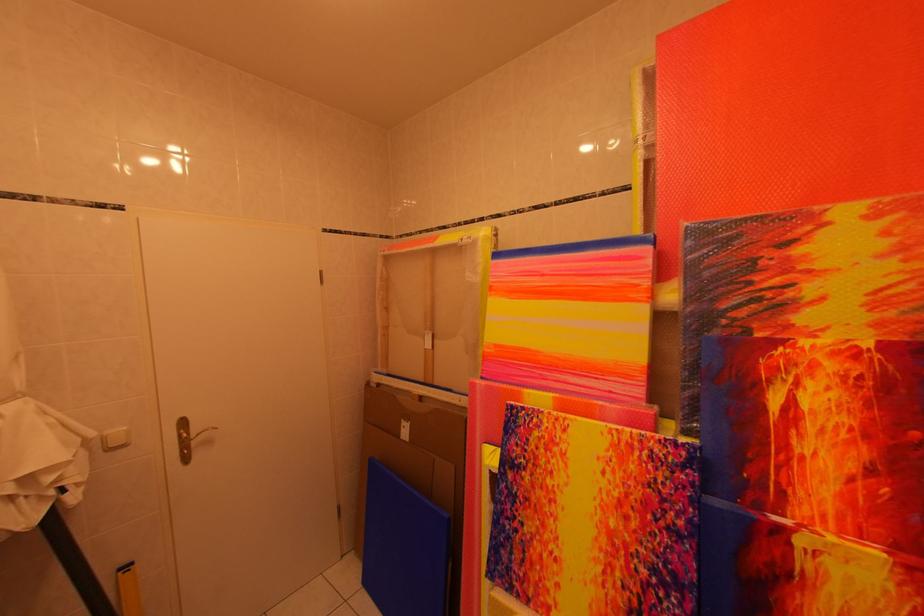
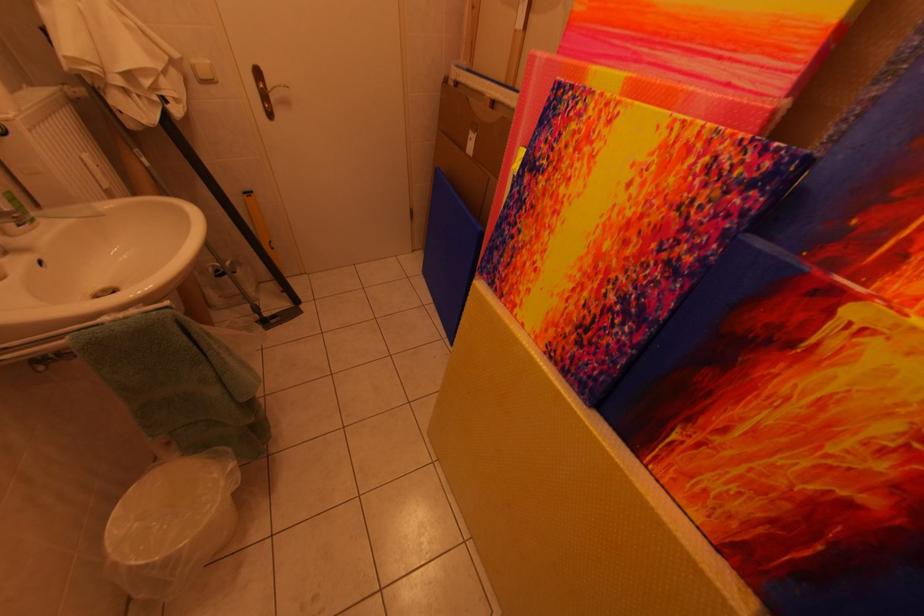
The point at [808,545] is marked in the first image. Where is the corresponding point in the second image?

(861, 317)